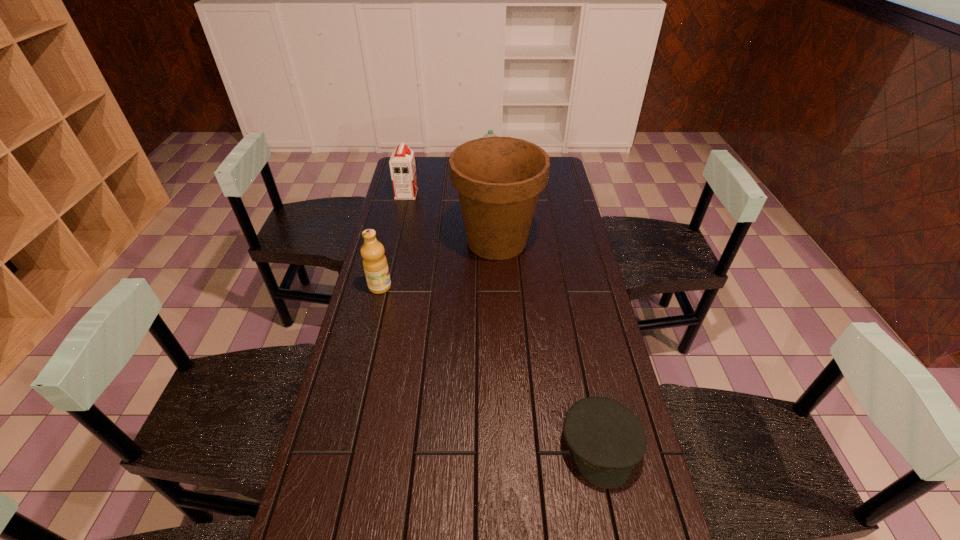
Where is `the tallest object`? the tallest object is located at coordinates (498, 179).

At what (x,y) coordinates should I click in order to perform the action: click on the third nearest object. Please return your answer as a coordinate pair (x, y). Image resolution: width=960 pixels, height=540 pixels. Looking at the image, I should click on click(x=498, y=179).

Where is `the farthest object`? The image size is (960, 540). the farthest object is located at coordinates (490, 133).

Where is `the fourth nearest object`? The width and height of the screenshot is (960, 540). the fourth nearest object is located at coordinates (402, 162).

Find the location of a particular element. olive oil is located at coordinates (375, 265).

In order to click on the nearest object in this screenshot , I will do `click(606, 438)`.

Image resolution: width=960 pixels, height=540 pixels. Find the location of `the shortest object`. the shortest object is located at coordinates (606, 438).

Where is `free region located on the back of the flowerpot`? This screenshot has height=540, width=960. free region located on the back of the flowerpot is located at coordinates (493, 171).

The image size is (960, 540). Identify the location of vacant point located on the left of the water bottle. (396, 181).

Where is `free space located on the right of the soya milk`? free space located on the right of the soya milk is located at coordinates (446, 194).